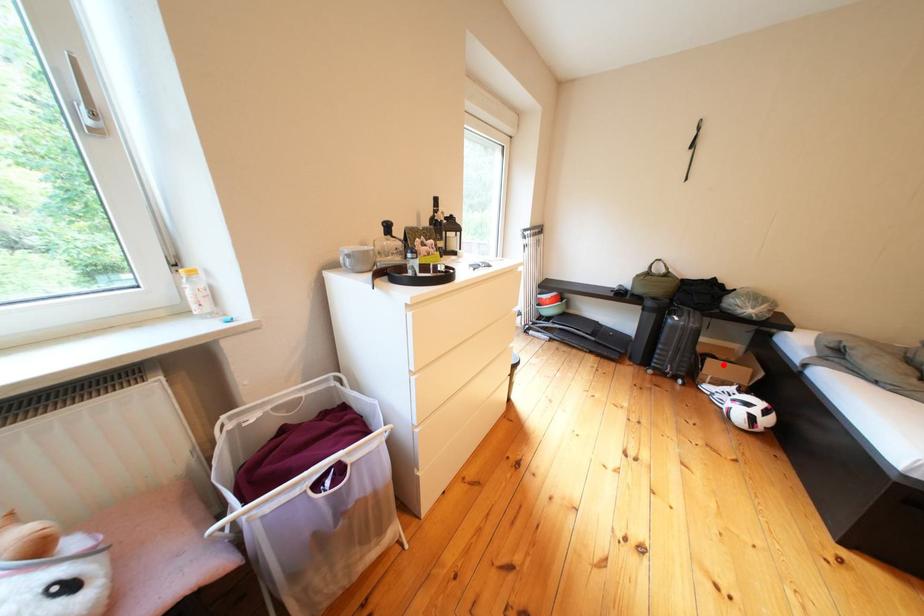
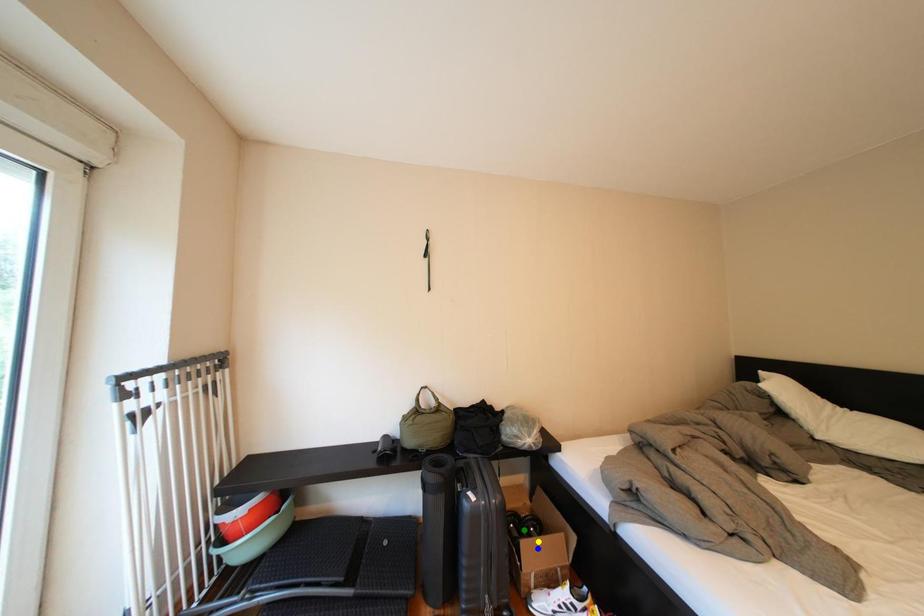
Question: I am providing you with two images of the same scene from different viewpoints. A red point is marked on the first image. You are given multiple points on the second image. Which spot in image 2 lines up with the point in image 1?

Choices:
 (A) blue point
 (B) yellow point
 (C) green point

Answer: (A)